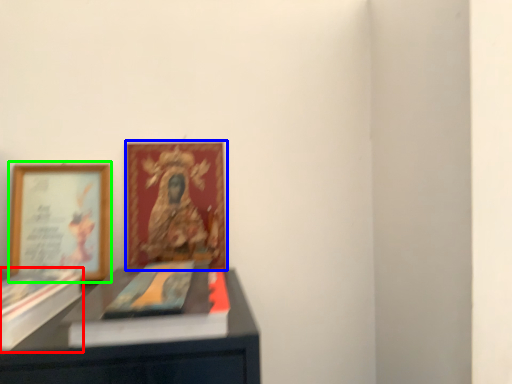
Question: Estimate the real-world distances between objects in this image. Which object is farther from paperback book (highlighted by a red box), picture frame (highlighted by a blue box) or picture frame (highlighted by a green box)?

Choices:
 (A) picture frame
 (B) picture frame

Answer: (A)